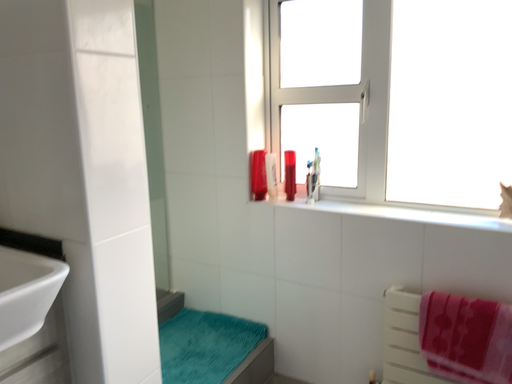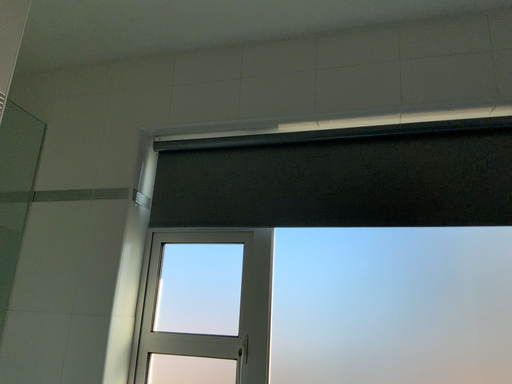
Question: Which way did the camera rotate in the video?

Choices:
 (A) rotated downward
 (B) rotated upward

Answer: (B)